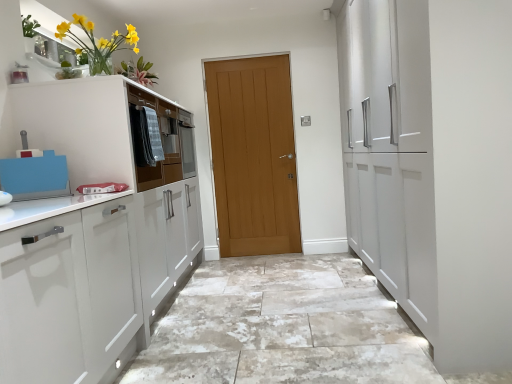
Question: From their relative heights in the image, would you say matte brown drawer at center is taller or shorter than marble-like granite floor at center?

Choices:
 (A) short
 (B) tall

Answer: (B)

Question: From a real-world perspective, relative to marble-like granite floor at center, is matte brown drawer at center vertically above or below?

Choices:
 (A) below
 (B) above

Answer: (B)

Question: Estimate the real-world distances between objects in this image. Which object is closer to the yellow glass vase at upper left?

Choices:
 (A) light brown wooden door at center
 (B) marble-like granite floor at center
 (C) matte brown drawer at center

Answer: (C)

Question: Which is farther from the matte brown drawer at center?

Choices:
 (A) marble-like granite floor at center
 (B) yellow glass vase at upper left
 (C) light brown wooden door at center

Answer: (A)